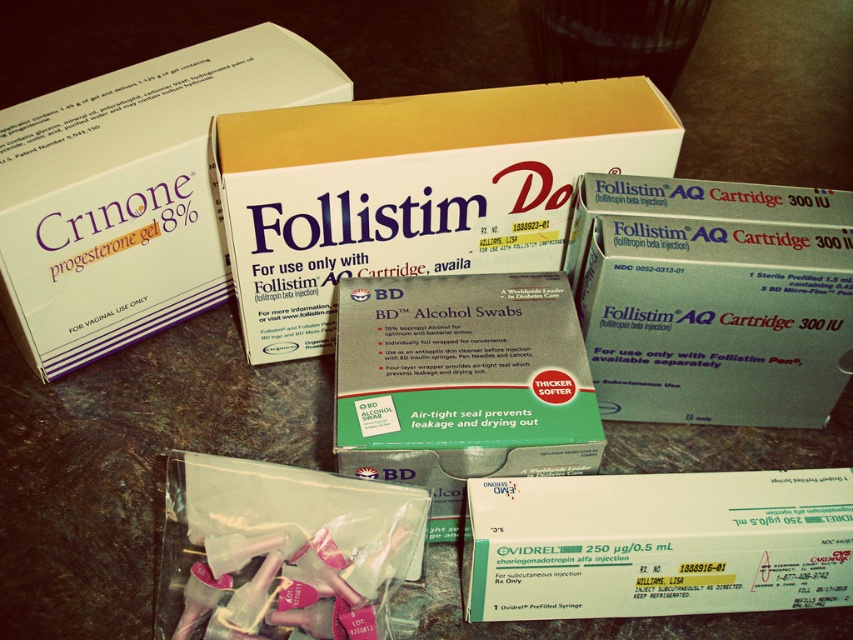
Question: Which of the following is the closest to the observer?

Choices:
 (A) green foil-wrapped alcohol swabs at center
 (B) matte white box at center

Answer: (A)

Question: Is white cardboard box at upper left above green cardboard box at center?

Choices:
 (A) no
 (B) yes

Answer: (B)

Question: Does green cardboard box at center have a lesser width compared to green foil-wrapped alcohol swabs at center?

Choices:
 (A) yes
 (B) no

Answer: (B)

Question: Estimate the real-world distances between objects in this image. Which object is closer to the white cardboard box at upper left?

Choices:
 (A) green cardboard box at center
 (B) white cardboard box at center
 (C) matte white box at center
 (D) clear plastic syringes at center

Answer: (B)

Question: Does white cardboard box at upper left have a greater width compared to green cardboard box at center?

Choices:
 (A) no
 (B) yes

Answer: (B)

Question: Which of the following is the farthest from the observer?

Choices:
 (A) white cardboard box at center
 (B) matte white box at center

Answer: (A)